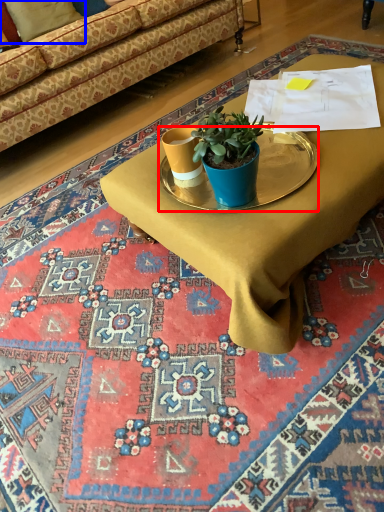
Question: Among these objects, which one is nearest to the camera, round table (highlighted by a red box) or pillow (highlighted by a blue box)?

Choices:
 (A) round table
 (B) pillow

Answer: (A)